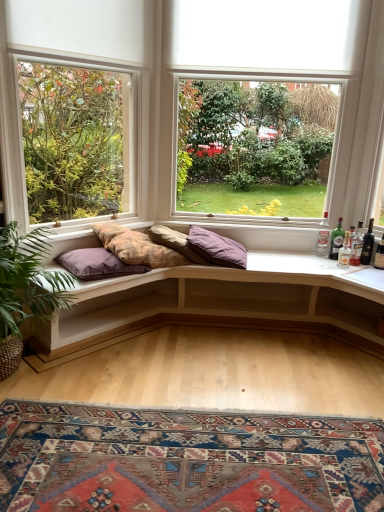
Question: Is matte white window at center, the second window positioned from the right, a part of purple soft cushion at center, placed as the third pillow when sorted from left to right?

Choices:
 (A) no
 (B) yes

Answer: (A)

Question: Can you confirm if purple soft cushion at center, which is the 1th pillow in right-to-left order, is wider than matte white window at center, the second window positioned from the right?

Choices:
 (A) yes
 (B) no

Answer: (A)

Question: Is purple soft cushion at center, which is the 1th pillow in right-to-left order, positioned with its back to matte white window at center, placed as the 1th window when sorted from left to right?

Choices:
 (A) yes
 (B) no

Answer: (B)

Question: Is purple soft cushion at center, placed as the third pillow when sorted from left to right, next to matte white window at center, placed as the 1th window when sorted from left to right, and touching it?

Choices:
 (A) no
 (B) yes

Answer: (A)

Question: Is purple soft cushion at center, which is the 1th pillow in right-to-left order, closer to camera compared to matte white window at center, placed as the 1th window when sorted from left to right?

Choices:
 (A) no
 (B) yes

Answer: (A)

Question: From a real-world perspective, is purple soft cushion at center, placed as the third pillow when sorted from left to right, positioned under matte white window at center, placed as the 1th window when sorted from left to right, based on gravity?

Choices:
 (A) no
 (B) yes

Answer: (B)

Question: From a real-world perspective, is green leafy plant at left beneath textured cotton cushions at center?

Choices:
 (A) no
 (B) yes

Answer: (B)

Question: Does green leafy plant at left have a lesser width compared to textured cotton cushions at center?

Choices:
 (A) no
 (B) yes

Answer: (A)

Question: Can textured cotton cushions at center be found inside green leafy plant at left?

Choices:
 (A) no
 (B) yes

Answer: (A)

Question: From the image's perspective, is green leafy plant at left located above textured cotton cushions at center?

Choices:
 (A) no
 (B) yes

Answer: (A)

Question: From a real-world perspective, is green leafy plant at left on textured cotton cushions at center?

Choices:
 (A) yes
 (B) no

Answer: (B)

Question: Is green leafy plant at left taller than textured cotton cushions at center?

Choices:
 (A) no
 (B) yes

Answer: (B)

Question: Is wooden cushioned bench at center beside green glass bottle at right, the third bottle viewed from the right?

Choices:
 (A) no
 (B) yes

Answer: (A)